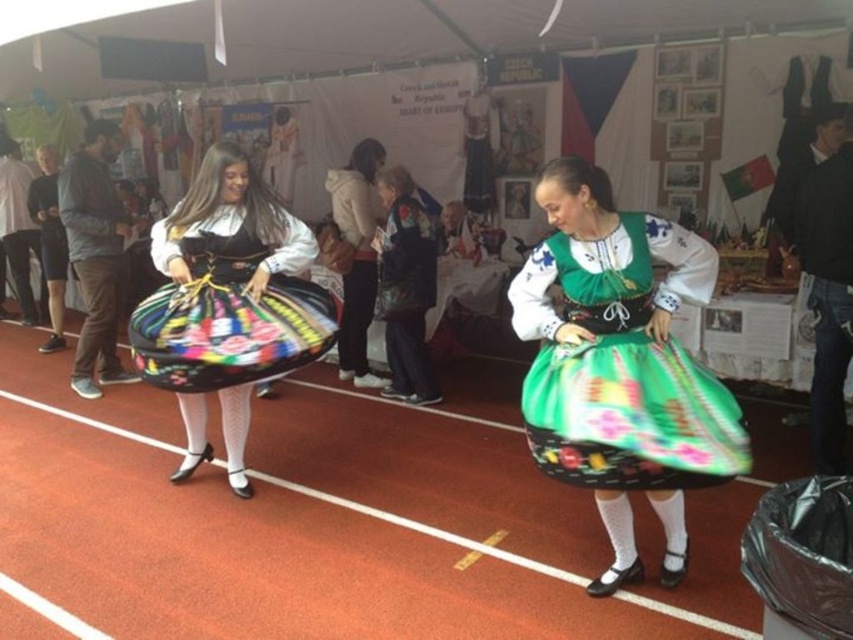
Does green satin dress at center have a larger size compared to white cotton hoodie at center?

Incorrect, green satin dress at center is not larger than white cotton hoodie at center.

At what (x,y) coordinates should I click in order to perform the action: click on green satin dress at center. Please return your answer as a coordinate pair (x, y). The width and height of the screenshot is (853, 640). Looking at the image, I should click on (624, 364).

Can you confirm if green satin dress at center is thinner than multicolored fabric skirt at center?

Yes.

How much distance is there between green satin dress at center and multicolored fabric skirt at center?

A distance of 4.43 feet exists between green satin dress at center and multicolored fabric skirt at center.

This screenshot has height=640, width=853. Describe the element at coordinates (624, 364) in the screenshot. I see `green satin dress at center` at that location.

Locate an element on the screen. This screenshot has width=853, height=640. green satin dress at center is located at coordinates (624, 364).

Consider the image. Which is more to the left, multicolored fabric skirt at center or white cotton hoodie at center?

multicolored fabric skirt at center

In the scene shown: Is multicolored fabric skirt at center below white cotton hoodie at center?

Yes, multicolored fabric skirt at center is below white cotton hoodie at center.

Who is more distant from viewer, (x=271, y=275) or (x=351, y=321)?

The point (x=351, y=321) is more distant.

Locate an element on the screen. multicolored fabric skirt at center is located at coordinates (228, 304).